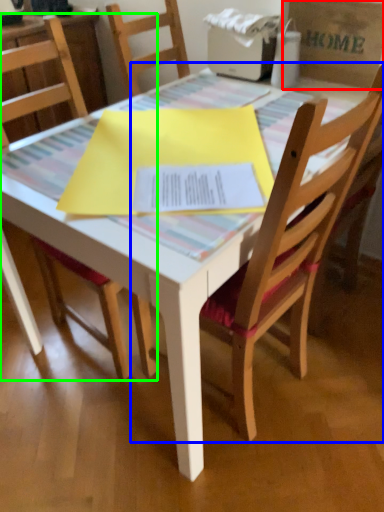
Question: Which object is positioned closest to cardboard box (highlighted by a red box)? Select from chair (highlighted by a blue box) and chair (highlighted by a green box).

Choices:
 (A) chair
 (B) chair

Answer: (A)